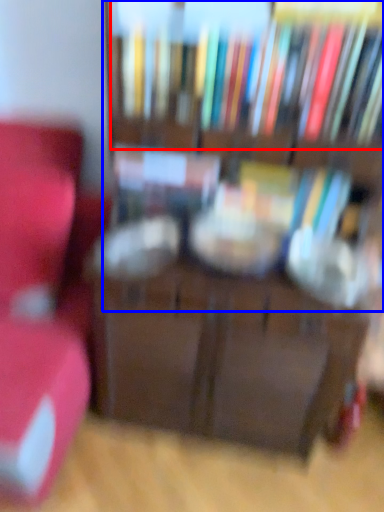
Question: Which of the following is the closest to the observer, book (highlighted by a red box) or bookcase (highlighted by a blue box)?

Choices:
 (A) book
 (B) bookcase

Answer: (B)